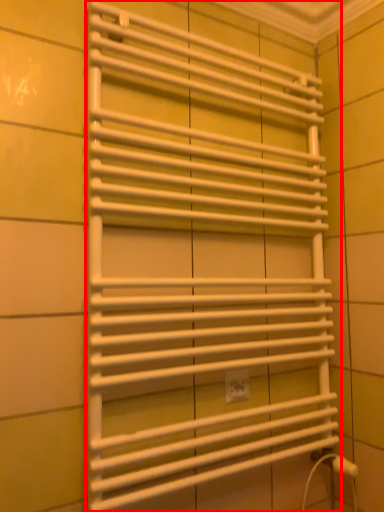
Question: From the image's perspective, what is the correct spatial positioning of towel rack (annotated by the red box) in reference to electric outlet?

Choices:
 (A) below
 (B) above

Answer: (B)